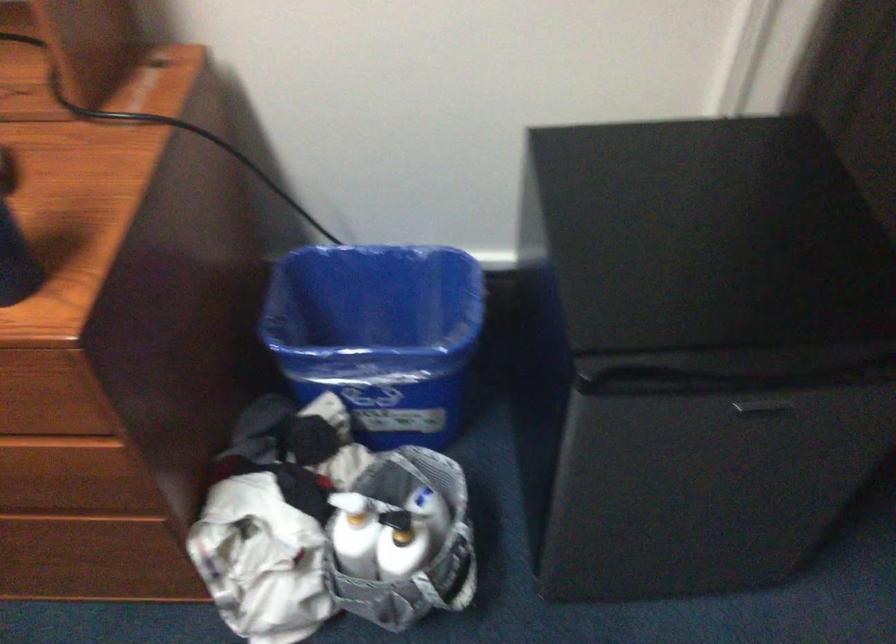
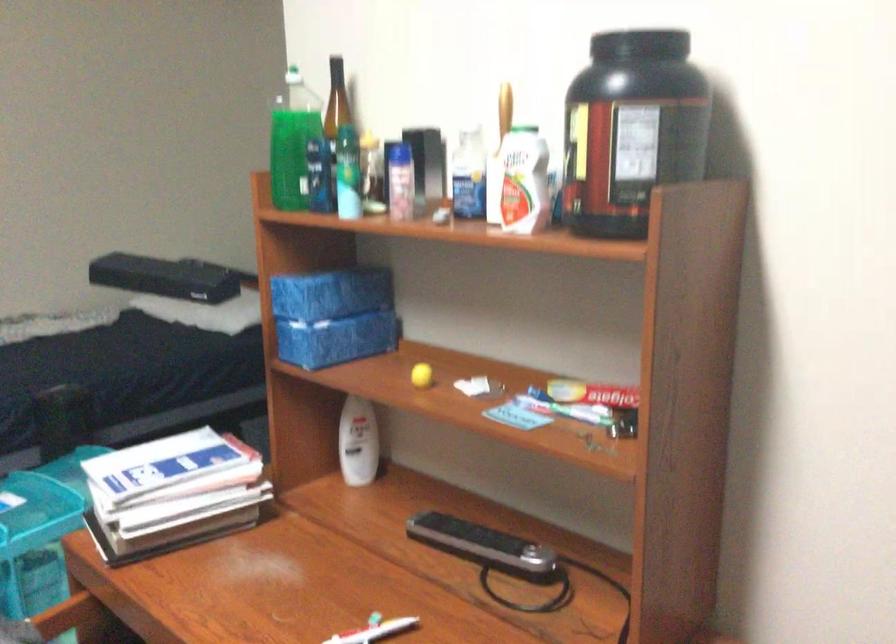
Consider the image. The first image is from the beginning of the video and the second image is from the end. How did the camera likely rotate when shooting the video?

The camera's rotation is toward left-up.